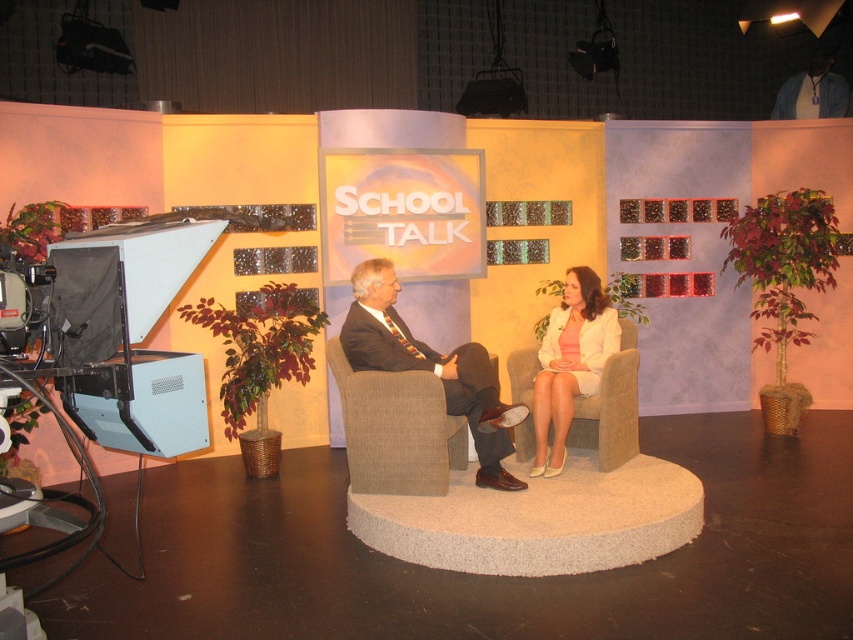
Question: Can you confirm if matte black suit at center is bigger than white fabric jacket at center?

Choices:
 (A) yes
 (B) no

Answer: (A)

Question: Which object is positioned farthest from the white fabric jacket at center?

Choices:
 (A) matte black suit at center
 (B) beige fabric armchair at center

Answer: (B)

Question: Does matte black suit at center appear on the right side of white fabric jacket at center?

Choices:
 (A) no
 (B) yes

Answer: (A)

Question: Is matte black suit at center wider than white fabric jacket at center?

Choices:
 (A) yes
 (B) no

Answer: (A)

Question: Among these points, which one is farthest from the camera?

Choices:
 (A) (448, 385)
 (B) (534, 456)

Answer: (B)

Question: Which point is farther to the camera?

Choices:
 (A) [x=541, y=448]
 (B) [x=381, y=492]
 (C) [x=451, y=397]

Answer: (A)